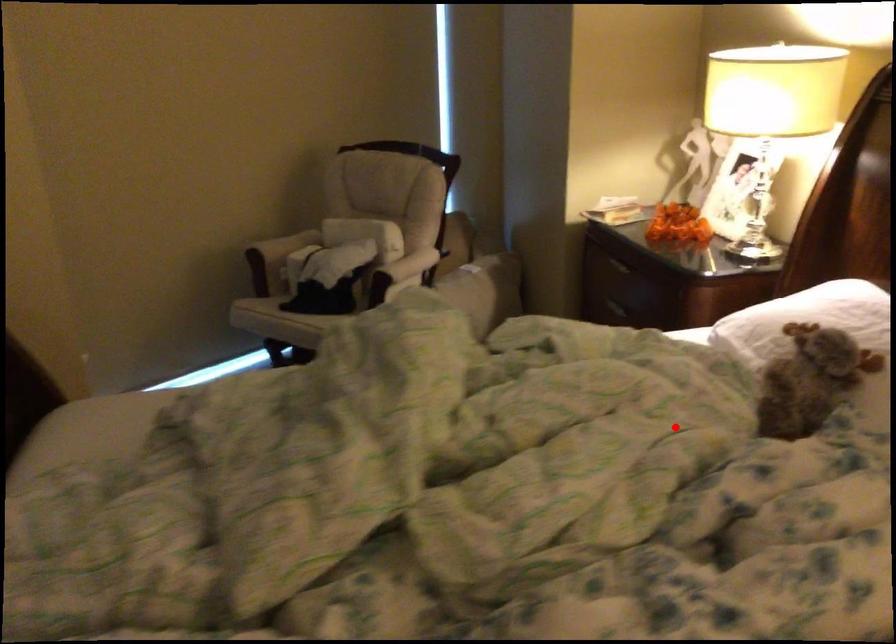
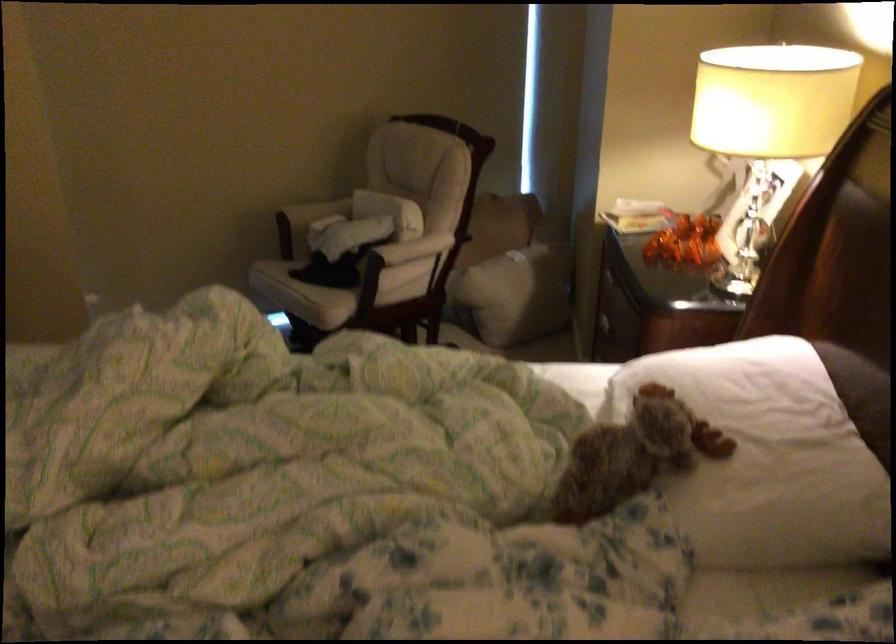
Question: I am providing you with two images of the same scene from different viewpoints. A red point is marked on the first image. Is the red point's position out of view in image 2?

Choices:
 (A) Yes
 (B) No

Answer: (B)